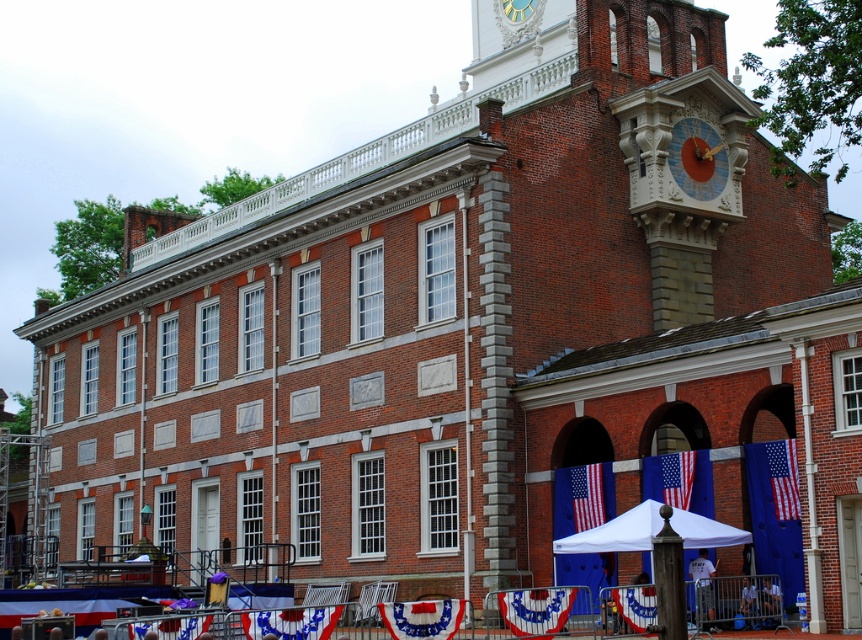
You are a visitor standing in front of the historic brick building with the clock tower on the right. You notice two red fabric items. Which one is placed higher up between the red fabric flag at lower center and the red fabric banner at center?

The red fabric flag at lower center is positioned over the red fabric banner at center, meaning it is placed higher up.

You are a window cleaner standing at the base of the historic brick building. You need to clean both the red fabric banner at center and the gold metallic clock at upper center. Which object will require you to climb higher to reach?

The gold metallic clock at upper center is located higher up on the building than the red fabric banner at center, so you will need to climb higher to reach the gold metallic clock at upper center.